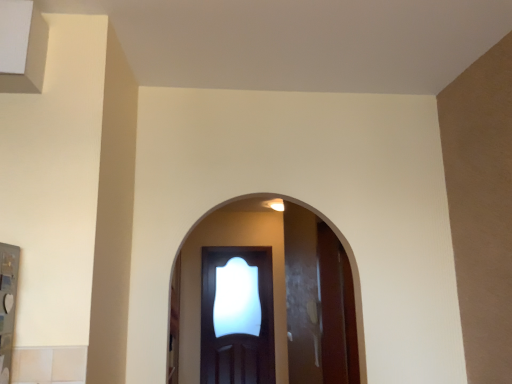
Question: From the image's perspective, is glossy wood door at center located above or below clear glass screen door at center?

Choices:
 (A) below
 (B) above

Answer: (B)

Question: Is glossy wood door at center situated inside clear glass screen door at center or outside?

Choices:
 (A) outside
 (B) inside

Answer: (A)

Question: Does point (258, 322) appear closer or farther from the camera than point (175, 342)?

Choices:
 (A) farther
 (B) closer

Answer: (A)

Question: From the image's perspective, is clear glass screen door at center above or below glossy wood door at center?

Choices:
 (A) below
 (B) above

Answer: (A)

Question: From a real-world perspective, is clear glass screen door at center physically located above or below glossy wood door at center?

Choices:
 (A) above
 (B) below

Answer: (B)

Question: Looking at their shapes, would you say clear glass screen door at center is wider or thinner than glossy wood door at center?

Choices:
 (A) wide
 (B) thin

Answer: (B)

Question: Would you say clear glass screen door at center is to the left or to the right of glossy wood door at center in the picture?

Choices:
 (A) left
 (B) right

Answer: (A)